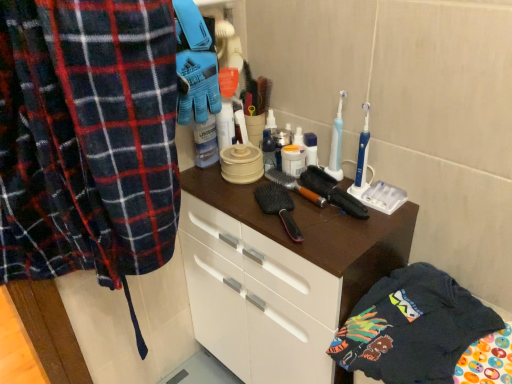
Image resolution: width=512 pixels, height=384 pixels. What do you see at coordinates (294, 186) in the screenshot?
I see `brown wooden brush at center, arranged as the 1th brush when viewed from the left` at bounding box center [294, 186].

The image size is (512, 384). I want to click on brown wooden brush at center, the 2th brush from the right, so click(294, 186).

What do you see at coordinates (298, 244) in the screenshot? This screenshot has height=384, width=512. I see `brown matte cabinet at center` at bounding box center [298, 244].

Find the location of a particular element. black rubber brush at center, the 2th brush when ordered from left to right is located at coordinates (332, 192).

Is point (409, 368) in front of point (294, 182)?

That is True.

Is dark blue cotton t-shirt at lower right surrounding brown wooden brush at center, arranged as the 1th brush when viewed from the left?

No, brown wooden brush at center, arranged as the 1th brush when viewed from the left, is located outside of dark blue cotton t-shirt at lower right.

Does dark blue cotton t-shirt at lower right turn towards brown wooden brush at center, the 2th brush from the right?

No, dark blue cotton t-shirt at lower right is not aimed at brown wooden brush at center, the 2th brush from the right.

Can brown matte cabinet at center be found inside black rubber brush at center, the 2th brush when ordered from left to right?

Actually, brown matte cabinet at center is outside black rubber brush at center, the 2th brush when ordered from left to right.

Could you tell me if black rubber brush at center, the 2th brush when ordered from left to right, is turned towards brown matte cabinet at center?

No, black rubber brush at center, the 2th brush when ordered from left to right, does not turn towards brown matte cabinet at center.

From a real-world perspective, which object rests below the other?

brown matte cabinet at center is physically lower.

Can you confirm if black rubber brush at center, the 1th brush when ordered from right to left, is taller than brown matte cabinet at center?

In fact, black rubber brush at center, the 1th brush when ordered from right to left, may be shorter than brown matte cabinet at center.

Is black rubber brush at center, the 1th brush when ordered from right to left, looking in the opposite direction of dark blue cotton t-shirt at lower right?

black rubber brush at center, the 1th brush when ordered from right to left, does not have its back to dark blue cotton t-shirt at lower right.

Can you tell me how much black rubber brush at center, the 2th brush when ordered from left to right, and dark blue cotton t-shirt at lower right differ in facing direction?

There is a 0.00113-degree angle between the facing directions of black rubber brush at center, the 2th brush when ordered from left to right, and dark blue cotton t-shirt at lower right.

Between black rubber brush at center, the 1th brush when ordered from right to left, and dark blue cotton t-shirt at lower right, which one has larger width?

Wider between the two is dark blue cotton t-shirt at lower right.

Looking at this image, which point is more distant from viewer, (347,195) or (441,335)?

The point (347,195) is farther from the camera.

How much distance is there between brown wooden brush at center, the 2th brush from the right, and dark blue cotton t-shirt at lower right?

A distance of 14.14 inches exists between brown wooden brush at center, the 2th brush from the right, and dark blue cotton t-shirt at lower right.

Does point (286, 181) come closer to viewer compared to point (428, 349)?

No, (286, 181) is behind (428, 349).

From a real-world perspective, is brown wooden brush at center, arranged as the 1th brush when viewed from the left, physically above dark blue cotton t-shirt at lower right?

Correct, in the physical world, brown wooden brush at center, arranged as the 1th brush when viewed from the left, is higher than dark blue cotton t-shirt at lower right.

Is the position of brown wooden brush at center, arranged as the 1th brush when viewed from the left, more distant than that of dark blue cotton t-shirt at lower right?

→ That is True.

Visually, is dark blue cotton t-shirt at lower right positioned to the left or to the right of black rubber brush at center, the 1th brush when ordered from right to left?

From the image, it's evident that dark blue cotton t-shirt at lower right is to the right of black rubber brush at center, the 1th brush when ordered from right to left.

Is dark blue cotton t-shirt at lower right spatially inside black rubber brush at center, the 1th brush when ordered from right to left, or outside of it?

dark blue cotton t-shirt at lower right is located beyond the bounds of black rubber brush at center, the 1th brush when ordered from right to left.

Is dark blue cotton t-shirt at lower right taller than black rubber brush at center, the 1th brush when ordered from right to left?

Correct, dark blue cotton t-shirt at lower right is much taller as black rubber brush at center, the 1th brush when ordered from right to left.

Considering the positions of points (245, 214) and (343, 193), is point (245, 214) farther from camera compared to point (343, 193)?

No, it is not.

Considering the sizes of objects brown matte cabinet at center and black rubber brush at center, the 1th brush when ordered from right to left, in the image provided, who is shorter, brown matte cabinet at center or black rubber brush at center, the 1th brush when ordered from right to left,?

With less height is black rubber brush at center, the 1th brush when ordered from right to left.

From the image's perspective, is brown matte cabinet at center below black rubber brush at center, the 1th brush when ordered from right to left?

Correct, brown matte cabinet at center appears lower than black rubber brush at center, the 1th brush when ordered from right to left, in the image.

From the image's perspective, which one is positioned lower, dark blue cotton t-shirt at lower right or brown matte cabinet at center?

dark blue cotton t-shirt at lower right is shown below in the image.

Who is bigger, dark blue cotton t-shirt at lower right or brown matte cabinet at center?

brown matte cabinet at center is bigger.

Considering the positions of points (442, 368) and (298, 353), is point (442, 368) closer to camera compared to point (298, 353)?

Yes, it is in front of point (298, 353).

Is the surface of dark blue cotton t-shirt at lower right in direct contact with brown matte cabinet at center?

No, dark blue cotton t-shirt at lower right is not making contact with brown matte cabinet at center.

Starting from the dark blue cotton t-shirt at lower right, which brush is the 2nd one to the left? Please provide its 2D coordinates.

[(294, 186)]

In the image, there is a black rubber brush at center, the 2th brush when ordered from left to right. Identify the location of cabinetry below it (from a real-world perspective). (298, 244).

Which object lies nearer to the anchor point brown matte cabinet at center, black rubber brush at center, the 2th brush when ordered from left to right, or dark blue cotton t-shirt at lower right?

Among the two, dark blue cotton t-shirt at lower right is located nearer to brown matte cabinet at center.

Based on their spatial positions, is dark blue cotton t-shirt at lower right or brown wooden brush at center, arranged as the 1th brush when viewed from the left, further from black rubber brush at center, the 1th brush when ordered from right to left?

dark blue cotton t-shirt at lower right is further to black rubber brush at center, the 1th brush when ordered from right to left.

Based on their spatial positions, is brown wooden brush at center, the 2th brush from the right, or black rubber brush at center, the 2th brush when ordered from left to right, further from dark blue cotton t-shirt at lower right?

brown wooden brush at center, the 2th brush from the right, lies further to dark blue cotton t-shirt at lower right than the other object.

Looking at the image, which one is located further to brown wooden brush at center, arranged as the 1th brush when viewed from the left, dark blue cotton t-shirt at lower right or brown matte cabinet at center?

dark blue cotton t-shirt at lower right.

Considering their positions, is dark blue cotton t-shirt at lower right positioned further to black rubber brush at center, the 1th brush when ordered from right to left, than brown matte cabinet at center?

dark blue cotton t-shirt at lower right is further to black rubber brush at center, the 1th brush when ordered from right to left.

When comparing their distances from brown matte cabinet at center, does dark blue cotton t-shirt at lower right or black rubber brush at center, the 2th brush when ordered from left to right, seem further?

black rubber brush at center, the 2th brush when ordered from left to right, lies further to brown matte cabinet at center than the other object.

From the picture: Based on their spatial positions, is black rubber brush at center, the 1th brush when ordered from right to left, or dark blue cotton t-shirt at lower right closer to brown wooden brush at center, arranged as the 1th brush when viewed from the left?

black rubber brush at center, the 1th brush when ordered from right to left.

In the scene shown: Which object lies nearer to the anchor point dark blue cotton t-shirt at lower right, black rubber brush at center, the 2th brush when ordered from left to right, or brown wooden brush at center, the 2th brush from the right?

black rubber brush at center, the 2th brush when ordered from left to right, is closer to dark blue cotton t-shirt at lower right.

This screenshot has height=384, width=512. In order to click on cabinetry between brown wooden brush at center, the 2th brush from the right, and dark blue cotton t-shirt at lower right in the up-down direction in this screenshot , I will do `click(298, 244)`.

This screenshot has width=512, height=384. What are the coordinates of `cabinetry between black rubber brush at center, the 1th brush when ordered from right to left, and dark blue cotton t-shirt at lower right, in the vertical direction` in the screenshot? It's located at (298, 244).

Where is `brush that lies between brown wooden brush at center, arranged as the 1th brush when viewed from the left, and brown matte cabinet at center from top to bottom`? Image resolution: width=512 pixels, height=384 pixels. brush that lies between brown wooden brush at center, arranged as the 1th brush when viewed from the left, and brown matte cabinet at center from top to bottom is located at coordinates (332, 192).

I want to click on brush between brown wooden brush at center, arranged as the 1th brush when viewed from the left, and dark blue cotton t-shirt at lower right in the up-down direction, so click(332, 192).